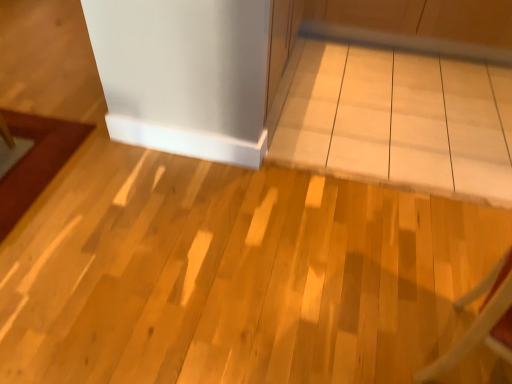
Where is `vacant space underneath wooden chair at lower right (from a real-world perspective)`? The height and width of the screenshot is (384, 512). vacant space underneath wooden chair at lower right (from a real-world perspective) is located at coordinates [x=452, y=345].